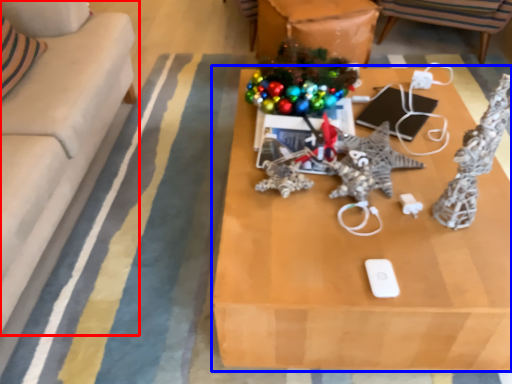
Question: Which object is further to the camera taking this photo, studio couch (highlighted by a red box) or table (highlighted by a blue box)?

Choices:
 (A) studio couch
 (B) table

Answer: (B)